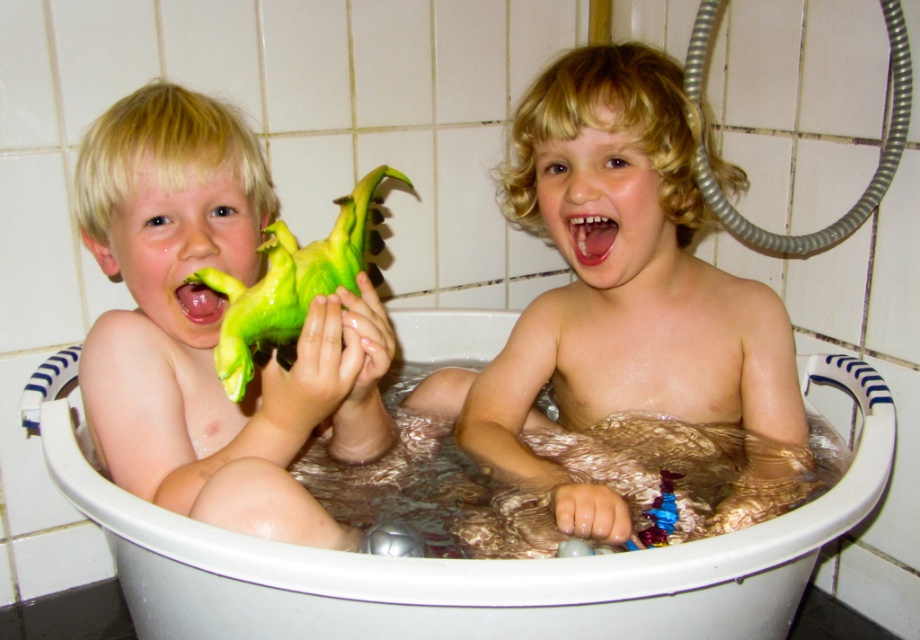
You are a parent trying to retrieve the green rubber parrot at left and the bright white teeth at center from the bathtub. If your hand can reach 12 inches, can you grab both items without moving your hand position?

The green rubber parrot at left and bright white teeth at center are 12.50 inches apart from each other. Since your hand can only reach 12 inches, you cannot grab both items without moving your hand position.

You are a parent trying to clean the bathtub. You need to retrieve the smooth plastic toy at center and the green rubber dinosaur at left. Can you reach both toys without moving your position? The parent can reach 12 inches from their current spot.

The smooth plastic toy at center is 13.03 inches away from the green rubber dinosaur at left, so the parent cannot reach both toys without moving since the distance exceeds their 12 inch reach.

You are a parent trying to retrieve the smooth plastic toy at center and the green rubber dinosaur at left from the bathtub. Which toy should you reach for first if you want to pick up the one that is closer to the water surface?

The smooth plastic toy at center is located above the green rubber dinosaur at left, so it is closer to the water surface and should be picked up first.